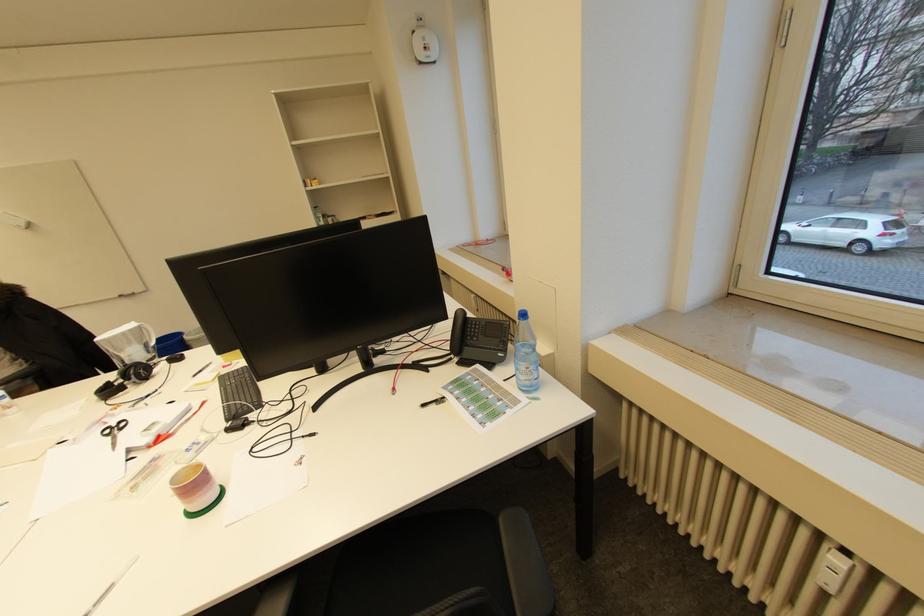
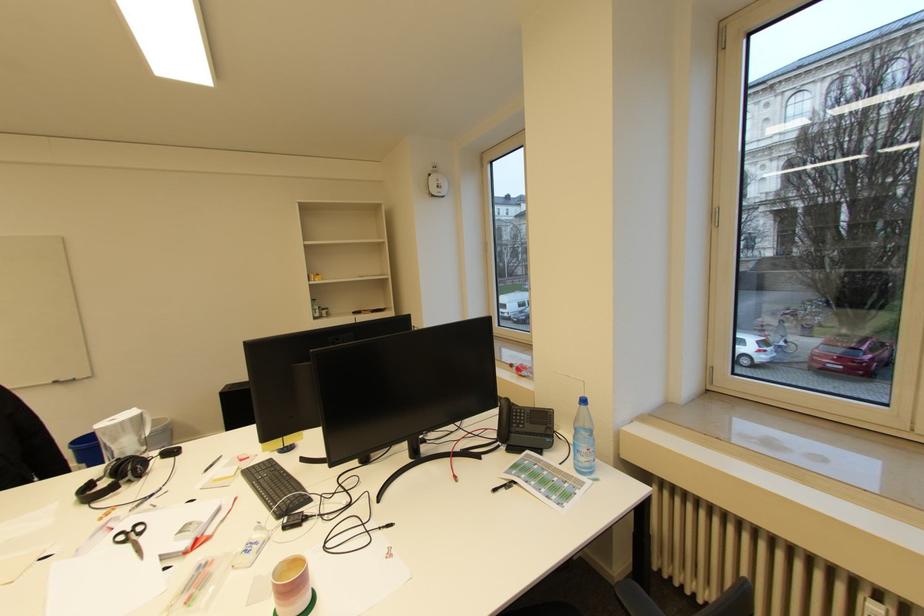
Question: The first image is from the beginning of the video and the second image is from the end. How did the camera likely rotate when shooting the video?

Choices:
 (A) Left
 (B) Right
 (C) Up
 (D) Down

Answer: (C)